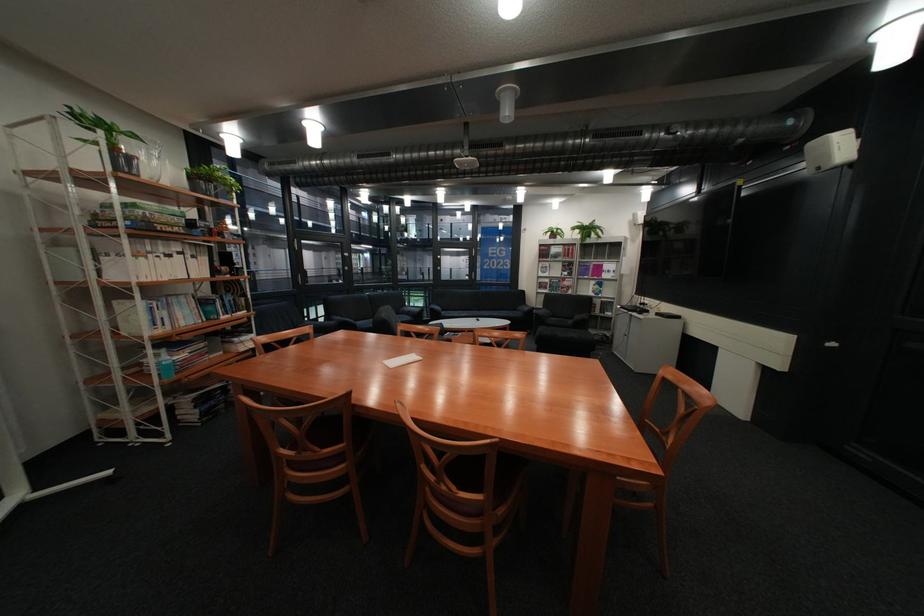
Find where to sit the sofa sitting surface. Please return your answer as a coordinate pair (x, y).

(489, 304)